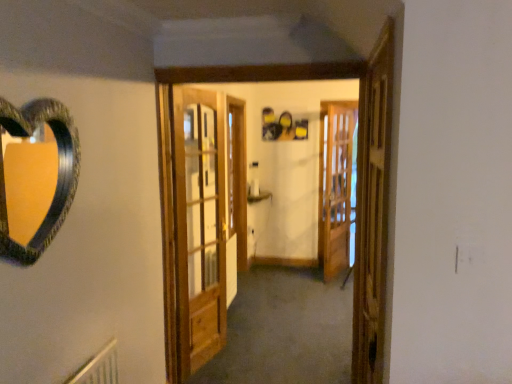
Where is `free spot below wooden barn door at center (from a real-world perspective)`? free spot below wooden barn door at center (from a real-world perspective) is located at coordinates (209, 357).